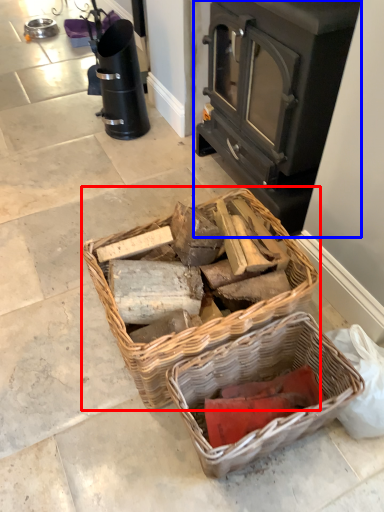
Question: Among these objects, which one is nearest to the camera, picnic basket (highlighted by a red box) or wood burning stove (highlighted by a blue box)?

Choices:
 (A) picnic basket
 (B) wood burning stove

Answer: (A)